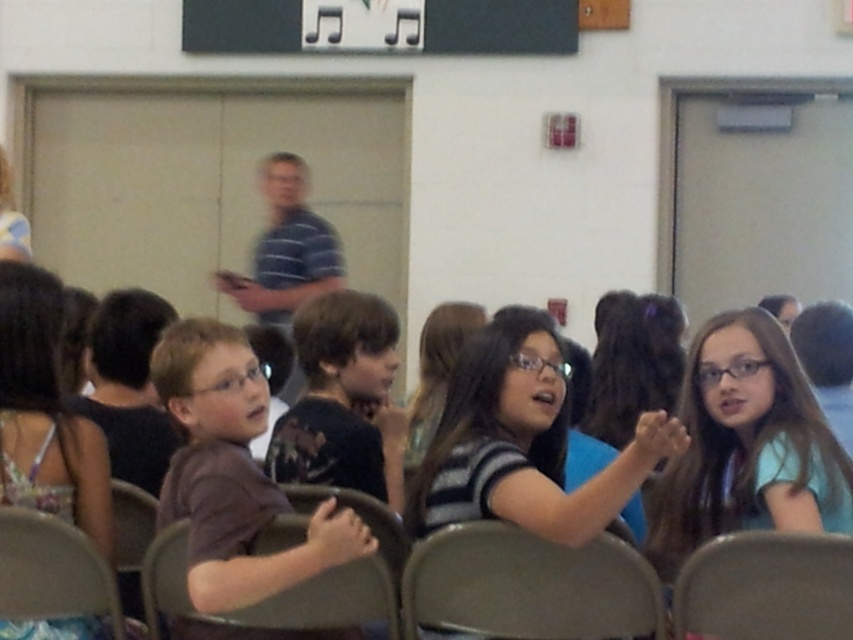
You need to choose a chair for a guest who requires a wider seat. Based on the scene, which chair between the metallic gray chair at center and the gray plastic chair at lower left would you recommend?

The metallic gray chair at center has a greater width than the gray plastic chair at lower left, so it would be the better choice for the guest needing a wider seat.